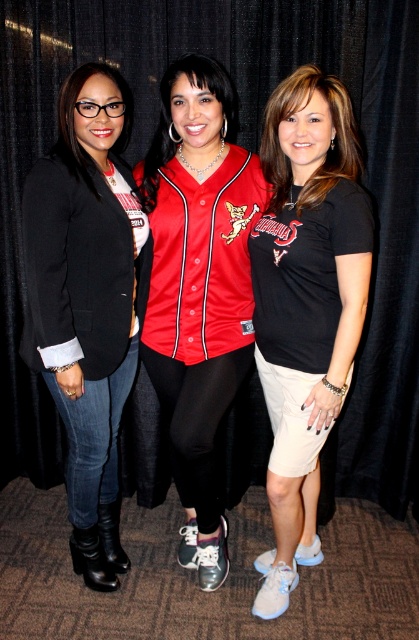
Question: Which is farther from the red matte baseball jersey at center?

Choices:
 (A) black matte t-shirt at center
 (B) matte black blazer at left

Answer: (B)

Question: Which point appears closest to the camera in this image?

Choices:
 (A) (100, 221)
 (B) (225, 136)

Answer: (A)

Question: Which object appears closest to the camera in this image?

Choices:
 (A) red matte baseball jersey at center
 (B) black matte t-shirt at center

Answer: (B)

Question: Does black matte t-shirt at center come in front of red matte baseball jersey at center?

Choices:
 (A) no
 (B) yes

Answer: (B)

Question: Does black matte t-shirt at center have a greater width compared to red matte baseball jersey at center?

Choices:
 (A) no
 (B) yes

Answer: (A)

Question: Can you confirm if matte black blazer at left is positioned to the left of red matte baseball jersey at center?

Choices:
 (A) yes
 (B) no

Answer: (A)